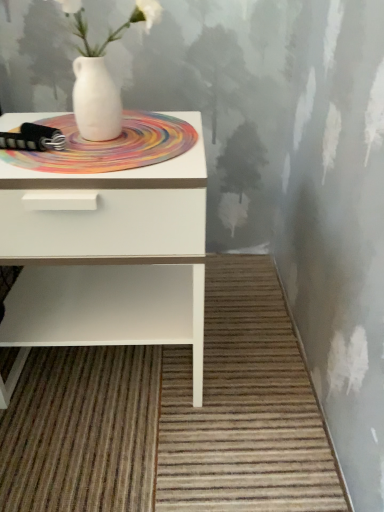
Question: Based on their positions, is multicolored woven mat at center located to the left or right of white glossy nightstand at left?

Choices:
 (A) left
 (B) right

Answer: (B)

Question: Is multicolored woven mat at center in front of or behind white glossy nightstand at left in the image?

Choices:
 (A) behind
 (B) front

Answer: (A)

Question: Based on their relative distances, which object is farther from the white matte vase at upper center?

Choices:
 (A) multicolored woven mat at center
 (B) white glossy nightstand at left

Answer: (B)

Question: Which object is the farthest from the white matte vase at upper center?

Choices:
 (A) multicolored woven mat at center
 (B) white glossy nightstand at left

Answer: (B)